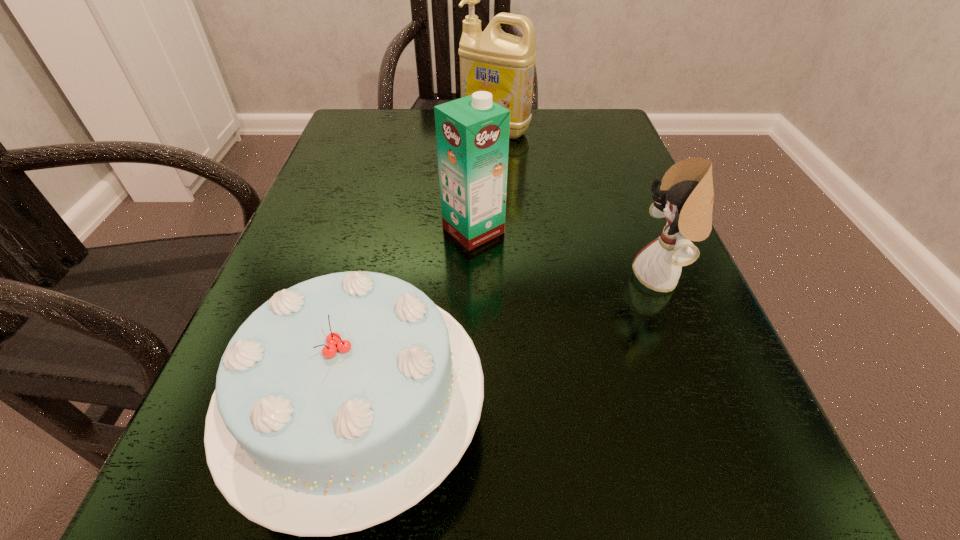
The width and height of the screenshot is (960, 540). What are the coordinates of `detergent` in the screenshot? It's located at (491, 60).

At what (x,y) coordinates should I click in order to perform the action: click on carton. Please return your answer as a coordinate pair (x, y). The width and height of the screenshot is (960, 540). Looking at the image, I should click on (472, 133).

Locate an element on the screen. doll is located at coordinates (686, 195).

This screenshot has width=960, height=540. In order to click on free point located 0.230m on the front of the detergent in this screenshot , I will do `click(499, 205)`.

Where is `vacant area situated 0.140m on the front of the carton`? This screenshot has width=960, height=540. vacant area situated 0.140m on the front of the carton is located at coordinates (472, 316).

Where is `free space located 0.260m at the front face of the doll`? free space located 0.260m at the front face of the doll is located at coordinates (464, 277).

This screenshot has width=960, height=540. Find the location of `vacant space located 0.230m at the front face of the doll`. vacant space located 0.230m at the front face of the doll is located at coordinates (483, 277).

This screenshot has width=960, height=540. I want to click on vacant space located at the front face of the doll, so click(405, 277).

In order to click on object that is at the far edge in this screenshot , I will do `click(491, 60)`.

Where is `object at the right edge`? The image size is (960, 540). object at the right edge is located at coordinates (686, 195).